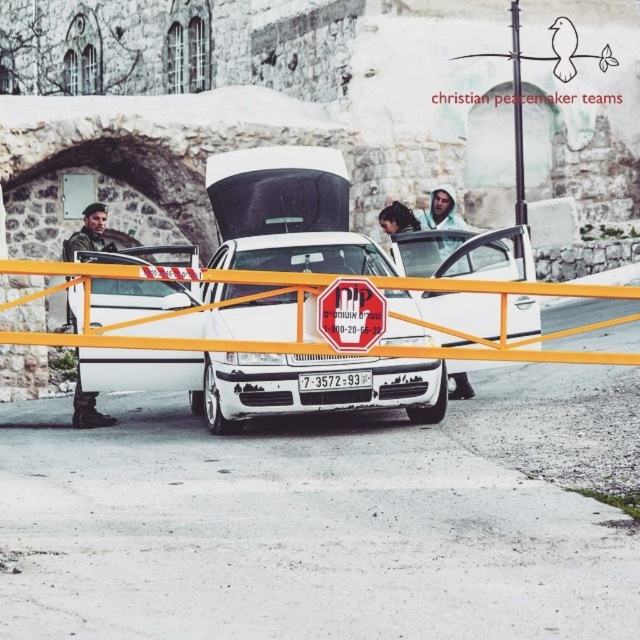
Question: Is red plastic stop sign at center wider than white plastic license plate at center?

Choices:
 (A) no
 (B) yes

Answer: (A)

Question: Among these points, which one is nearest to the camera?

Choices:
 (A) (324, 372)
 (B) (320, 294)
 (C) (92, 218)

Answer: (B)

Question: Is white glossy car at center smaller than red plastic stop sign at center?

Choices:
 (A) yes
 (B) no

Answer: (B)

Question: Which point is closer to the camera?

Choices:
 (A) white glossy car at center
 (B) white plastic license plate at center
 (C) red plastic stop sign at center
 (D) camouflage fabric uniform at center

Answer: (C)

Question: Can you confirm if red plastic stop sign at center is bigger than camouflage fabric uniform at center?

Choices:
 (A) yes
 (B) no

Answer: (B)

Question: Which object is positioned farthest from the white plastic license plate at center?

Choices:
 (A) red plastic stop sign at center
 (B) camouflage fabric uniform at center
 (C) white glossy car at center

Answer: (B)